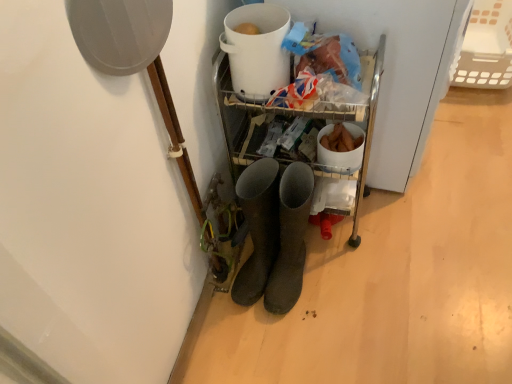
Where is `vacant space in front of dark gray rubber boots at center`? The image size is (512, 384). vacant space in front of dark gray rubber boots at center is located at coordinates (308, 343).